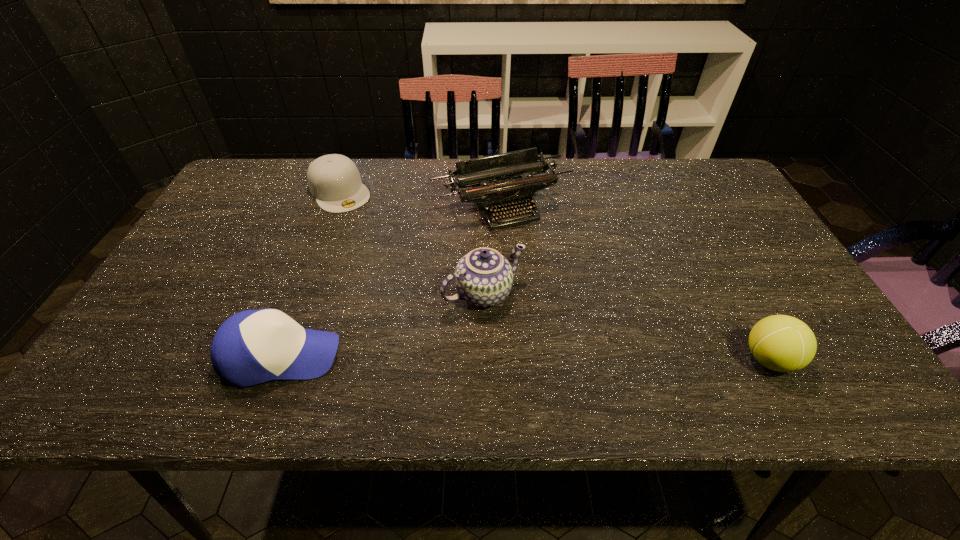
Identify the location of vacant area between the baseball cap and the typewriter. (391, 281).

The image size is (960, 540). What are the coordinates of `vacant area between the cap and the chinaware` in the screenshot? It's located at (412, 242).

Where is `free space that is in between the baseball cap and the typewriter`? This screenshot has width=960, height=540. free space that is in between the baseball cap and the typewriter is located at coordinates (391, 281).

At what (x,y) coordinates should I click in order to perform the action: click on vacant point located between the rightmost object and the cap. Please return your answer as a coordinate pair (x, y). Looking at the image, I should click on (554, 275).

This screenshot has height=540, width=960. Identify the location of unoccupied position between the chinaware and the baseball cap. (382, 325).

Locate an element on the screen. object that is the second nearest to the tennis ball is located at coordinates (513, 185).

The width and height of the screenshot is (960, 540). What are the coordinates of `the fourth closest object relative to the typewriter` in the screenshot? It's located at (782, 343).

The image size is (960, 540). In order to click on free region that satisfies the following two spatial constraints: 1. on the back side of the chinaware; 2. on the right side of the typewriter in this screenshot , I will do `click(483, 207)`.

Locate an element on the screen. vacant position in the image that satisfies the following two spatial constraints: 1. on the front side of the cap; 2. on the front-facing side of the baseball cap is located at coordinates (277, 356).

Identify the location of free space in the image that satisfies the following two spatial constraints: 1. on the front side of the baseball cap; 2. on the front-facing side of the cap. The width and height of the screenshot is (960, 540). (277, 356).